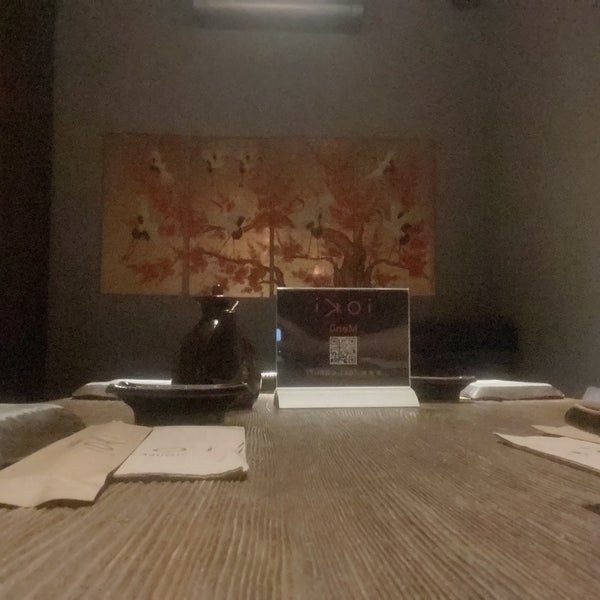
Find the location of `black kettle`. black kettle is located at coordinates (213, 348).